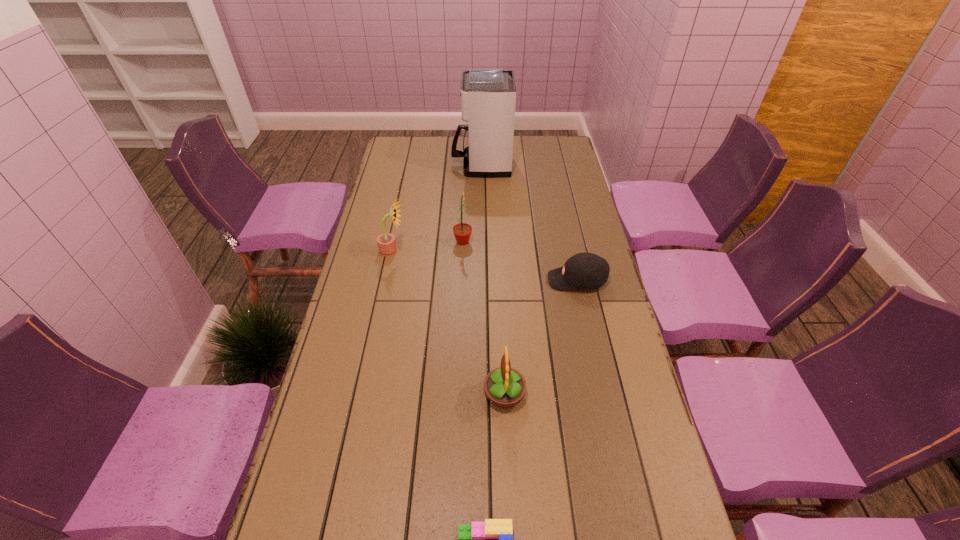
The height and width of the screenshot is (540, 960). In order to click on object that is at the left edge in this screenshot , I will do `click(386, 242)`.

You are a GUI agent. You are given a task and a screenshot of the screen. Output one action in this format:
    pyautogui.click(x=<x>, y=<y>)
    Task: Click on the object that is positioned at the right edge
    The image size is (960, 540).
    Given the screenshot: What is the action you would take?
    pyautogui.click(x=584, y=270)

At what (x,y) coordinates should I click in order to perform the action: click on vacant space at the left edge of the desktop. Please return your answer as a coordinate pair (x, y). Image resolution: width=960 pixels, height=540 pixels. Looking at the image, I should click on (375, 240).

The width and height of the screenshot is (960, 540). Find the location of `free space at the right edge of the desktop`. free space at the right edge of the desktop is located at coordinates (574, 234).

This screenshot has height=540, width=960. I want to click on vacant area that lies between the leftmost object and the baseball cap, so [x=485, y=265].

Where is `vacant area that lies between the coffee maker and the rightmost sunflower`? Image resolution: width=960 pixels, height=540 pixels. vacant area that lies between the coffee maker and the rightmost sunflower is located at coordinates (492, 279).

In order to click on free spot between the rightmost sunflower and the coffee maker in this screenshot , I will do [492, 279].

Locate an element on the screen. free space between the third shortest object and the tallest object is located at coordinates (492, 279).

At what (x,y) coordinates should I click in order to perform the action: click on vacant area that lies between the rightmost object and the coffee maker. Please return your answer as a coordinate pair (x, y). Looking at the image, I should click on (529, 222).

Point out which object is positioned as the fourth nearest to the Lego. Please provide its 2D coordinates. Your answer should be formatted as a tuple, i.e. [(x, y)], where the tuple contains the x and y coordinates of a point satisfying the conditions above.

[(462, 231)]